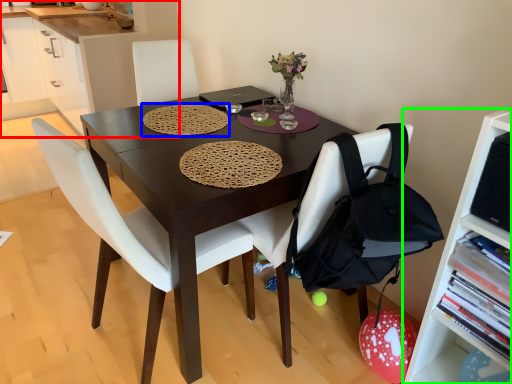
Question: Estimate the real-world distances between objects in this image. Which object is closer to cabinetry (highlighted by a red box), mat (highlighted by a blue box) or shelf (highlighted by a green box)?

Choices:
 (A) mat
 (B) shelf

Answer: (A)